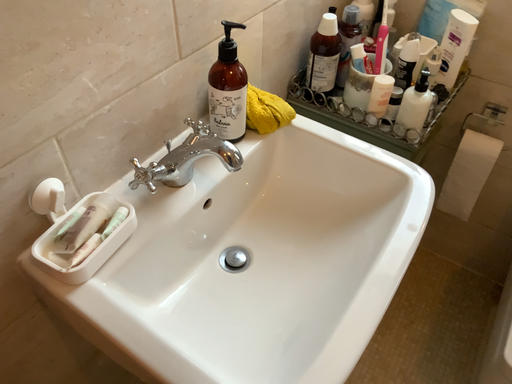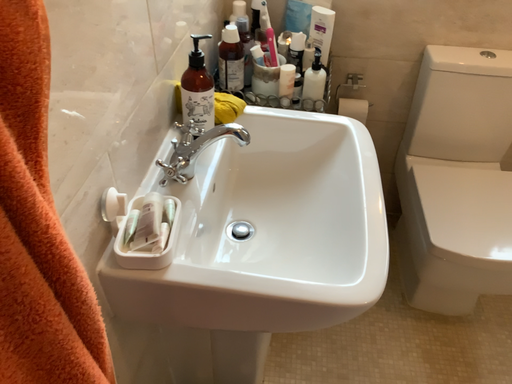
Question: Which way did the camera rotate in the video?

Choices:
 (A) rotated upward
 (B) rotated downward

Answer: (A)